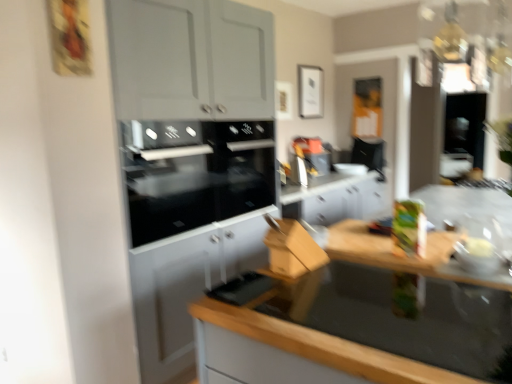
What are the coordinates of `green matte box at right, acting as the second appliance starting from the back` in the screenshot? It's located at (409, 229).

The height and width of the screenshot is (384, 512). What do you see at coordinates (409, 229) in the screenshot?
I see `green matte box at right, marked as the 2th appliance in a front-to-back arrangement` at bounding box center [409, 229].

In order to click on black glass oven at center, arranged as the third appliance when viewed from the right in this screenshot , I will do `click(240, 166)`.

Is black glass oven at center, arranged as the third appliance when viewed from the right, surrounding matte plastic bowl at right, the 3th appliance in the left-to-right sequence?

Definitely not — matte plastic bowl at right, the 3th appliance in the left-to-right sequence, is not inside black glass oven at center, arranged as the third appliance when viewed from the right.

From the image's perspective, would you say black glass oven at center, which ranks as the first appliance in left-to-right order, is positioned over matte plastic bowl at right, the 3th appliance in the left-to-right sequence?

Correct, black glass oven at center, which ranks as the first appliance in left-to-right order, appears higher than matte plastic bowl at right, the 3th appliance in the left-to-right sequence, in the image.

Between black glass oven at center, arranged as the third appliance when viewed from the right, and matte plastic bowl at right, marked as the first appliance in a front-to-back arrangement, which one is positioned in front?

matte plastic bowl at right, marked as the first appliance in a front-to-back arrangement, is closer to the camera.

How much distance is there between black glass oven at center, arranged as the third appliance when viewed from the right, and matte plastic bowl at right, marked as the first appliance in a front-to-back arrangement?

black glass oven at center, arranged as the third appliance when viewed from the right, is 4.65 feet from matte plastic bowl at right, marked as the first appliance in a front-to-back arrangement.

From the picture: Which is more to the right, wooden at lower right or green matte box at right, acting as the second appliance starting from the back?

From the viewer's perspective, green matte box at right, acting as the second appliance starting from the back, appears more on the right side.

From the image's perspective, which object appears higher, wooden at lower right or green matte box at right, which is the 2th appliance from right to left?

green matte box at right, which is the 2th appliance from right to left.

Are wooden at lower right and green matte box at right, which is the 2th appliance from right to left, located far from each other?

No, wooden at lower right is not far away from green matte box at right, which is the 2th appliance from right to left.

From a real-world perspective, which appliance is the 2nd one above the wooden at lower right? Please provide its 2D coordinates.

[(409, 229)]

From a real-world perspective, between matte plastic bowl at right, marked as the first appliance in a front-to-back arrangement, and black glass oven at center, which ranks as the first appliance in left-to-right order, who is vertically higher?

black glass oven at center, which ranks as the first appliance in left-to-right order.

Relative to black glass oven at center, which ranks as the first appliance in left-to-right order, is matte plastic bowl at right, positioned as the third appliance in back-to-front order, in front or behind?

matte plastic bowl at right, positioned as the third appliance in back-to-front order, is in front of black glass oven at center, which ranks as the first appliance in left-to-right order.

Considering the sizes of objects matte plastic bowl at right, positioned as the third appliance in back-to-front order, and black glass oven at center, which is counted as the third appliance, starting from the front, in the image provided, who is smaller, matte plastic bowl at right, positioned as the third appliance in back-to-front order, or black glass oven at center, which is counted as the third appliance, starting from the front,?

matte plastic bowl at right, positioned as the third appliance in back-to-front order, is smaller.

This screenshot has height=384, width=512. In order to click on countertop below the matte plastic bowl at right, the first appliance viewed from the right (from a real-world perspective) in this screenshot , I will do `click(358, 320)`.

Are wooden at lower right and matte plastic bowl at right, positioned as the third appliance in back-to-front order, far apart?

Result: No, wooden at lower right is not far away from matte plastic bowl at right, positioned as the third appliance in back-to-front order.

Can you confirm if wooden at lower right is bigger than matte plastic bowl at right, the 3th appliance in the left-to-right sequence?

Indeed, wooden at lower right has a larger size compared to matte plastic bowl at right, the 3th appliance in the left-to-right sequence.

Is wooden at lower right in front of matte plastic bowl at right, marked as the first appliance in a front-to-back arrangement?

Yes, the depth of wooden at lower right is less than that of matte plastic bowl at right, marked as the first appliance in a front-to-back arrangement.

From the image's perspective, would you say wooden at lower right is positioned over black glass oven at center, arranged as the third appliance when viewed from the right?

No, from the image's perspective, wooden at lower right is not on top of black glass oven at center, arranged as the third appliance when viewed from the right.

Is wooden at lower right taller than black glass oven at center, which is counted as the third appliance, starting from the front?

Indeed, wooden at lower right has a greater height compared to black glass oven at center, which is counted as the third appliance, starting from the front.

From a real-world perspective, count 3rd appliances upward from the wooden at lower right and point to it. Please provide its 2D coordinates.

[(240, 166)]

Is point (310, 369) in front of point (226, 174)?

Yes, point (310, 369) is closer to viewer.

Could you tell me if green matte box at right, marked as the 2th appliance in a front-to-back arrangement, is facing wooden at lower right?

No, green matte box at right, marked as the 2th appliance in a front-to-back arrangement, is not turned towards wooden at lower right.

Would you say green matte box at right, the 2th appliance in the left-to-right sequence, is outside wooden at lower right?

Absolutely, green matte box at right, the 2th appliance in the left-to-right sequence, is external to wooden at lower right.

Relative to wooden at lower right, is green matte box at right, acting as the second appliance starting from the back, in front or behind?

green matte box at right, acting as the second appliance starting from the back, is behind wooden at lower right.

What's the angular difference between green matte box at right, marked as the 2th appliance in a front-to-back arrangement, and wooden at lower right's facing directions?

93.1 degrees.

Can we say matte plastic bowl at right, positioned as the third appliance in back-to-front order, lies outside wooden at lower right?

Yes.

Are matte plastic bowl at right, marked as the first appliance in a front-to-back arrangement, and wooden at lower right located far from each other?

That's not correct — matte plastic bowl at right, marked as the first appliance in a front-to-back arrangement, is a little close to wooden at lower right.

Is matte plastic bowl at right, marked as the first appliance in a front-to-back arrangement, oriented away from wooden at lower right?

No, matte plastic bowl at right, marked as the first appliance in a front-to-back arrangement,'s orientation is not away from wooden at lower right.

Is matte plastic bowl at right, positioned as the third appliance in back-to-front order, in front of or behind wooden at lower right in the image?

Clearly, matte plastic bowl at right, positioned as the third appliance in back-to-front order, is behind wooden at lower right.

From a real-world perspective, which appliance is the 2nd one underneath the black glass oven at center, which is counted as the third appliance, starting from the front? Please provide its 2D coordinates.

[(477, 256)]

Find the location of a particular element. appliance that is the 2nd object located above the wooden at lower right (from the image's perspective) is located at coordinates (x=409, y=229).

Which object lies further to the anchor point wooden at lower right, green matte box at right, marked as the 2th appliance in a front-to-back arrangement, or matte plastic bowl at right, the 3th appliance in the left-to-right sequence?

Among the two, green matte box at right, marked as the 2th appliance in a front-to-back arrangement, is located further to wooden at lower right.

From the image, which object appears to be farther from black glass oven at center, which appears as the first appliance when viewed from the back, matte plastic bowl at right, positioned as the third appliance in back-to-front order, or wooden at lower right?

Among the two, matte plastic bowl at right, positioned as the third appliance in back-to-front order, is located further to black glass oven at center, which appears as the first appliance when viewed from the back.

From the picture: Considering their positions, is wooden at lower right positioned further to matte plastic bowl at right, the first appliance viewed from the right, than green matte box at right, which is the 2th appliance from right to left?

wooden at lower right.

When comparing their distances from green matte box at right, which is the 2th appliance from right to left, does wooden at lower right or matte plastic bowl at right, positioned as the third appliance in back-to-front order, seem closer?

matte plastic bowl at right, positioned as the third appliance in back-to-front order, is closer to green matte box at right, which is the 2th appliance from right to left.

Estimate the real-world distances between objects in this image. Which object is closer to green matte box at right, the 2th appliance in the left-to-right sequence, matte plastic bowl at right, the 3th appliance in the left-to-right sequence, or black glass oven at center, which is counted as the third appliance, starting from the front?

matte plastic bowl at right, the 3th appliance in the left-to-right sequence, is closer to green matte box at right, the 2th appliance in the left-to-right sequence.

Estimate the real-world distances between objects in this image. Which object is further from matte plastic bowl at right, the 3th appliance in the left-to-right sequence, black glass oven at center, arranged as the third appliance when viewed from the right, or green matte box at right, acting as the second appliance starting from the back?

black glass oven at center, arranged as the third appliance when viewed from the right, lies further to matte plastic bowl at right, the 3th appliance in the left-to-right sequence, than the other object.

Based on the photo, which object lies further to the anchor point green matte box at right, the 2th appliance in the left-to-right sequence, black glass oven at center, which is counted as the third appliance, starting from the front, or wooden at lower right?

black glass oven at center, which is counted as the third appliance, starting from the front, is further to green matte box at right, the 2th appliance in the left-to-right sequence.

Based on their spatial positions, is black glass oven at center, which is counted as the third appliance, starting from the front, or matte plastic bowl at right, marked as the first appliance in a front-to-back arrangement, closer to wooden at lower right?

Among the two, matte plastic bowl at right, marked as the first appliance in a front-to-back arrangement, is located nearer to wooden at lower right.

Where is `appliance between matte plastic bowl at right, the 3th appliance in the left-to-right sequence, and black glass oven at center, which is counted as the third appliance, starting from the front, in the front-back direction`? This screenshot has height=384, width=512. appliance between matte plastic bowl at right, the 3th appliance in the left-to-right sequence, and black glass oven at center, which is counted as the third appliance, starting from the front, in the front-back direction is located at coordinates (409, 229).

The height and width of the screenshot is (384, 512). I want to click on appliance between wooden at lower right and green matte box at right, the 2th appliance in the left-to-right sequence, along the z-axis, so click(477, 256).